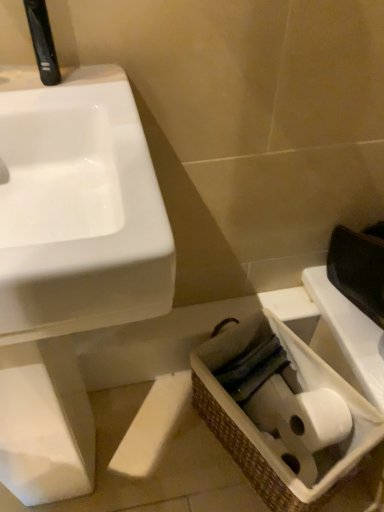
Question: Considering the positions of black plastic faucet at upper left and white glossy sink at left in the image, is black plastic faucet at upper left bigger or smaller than white glossy sink at left?

Choices:
 (A) small
 (B) big

Answer: (A)

Question: From their relative heights in the image, would you say black plastic faucet at upper left is taller or shorter than white glossy sink at left?

Choices:
 (A) tall
 (B) short

Answer: (B)

Question: Which object is the closest to the white glossy sink at left?

Choices:
 (A) black plastic faucet at upper left
 (B) woven brown basket at lower right

Answer: (A)

Question: Considering the real-world distances, which object is farthest from the black plastic faucet at upper left?

Choices:
 (A) white glossy sink at left
 (B) woven brown basket at lower right

Answer: (B)